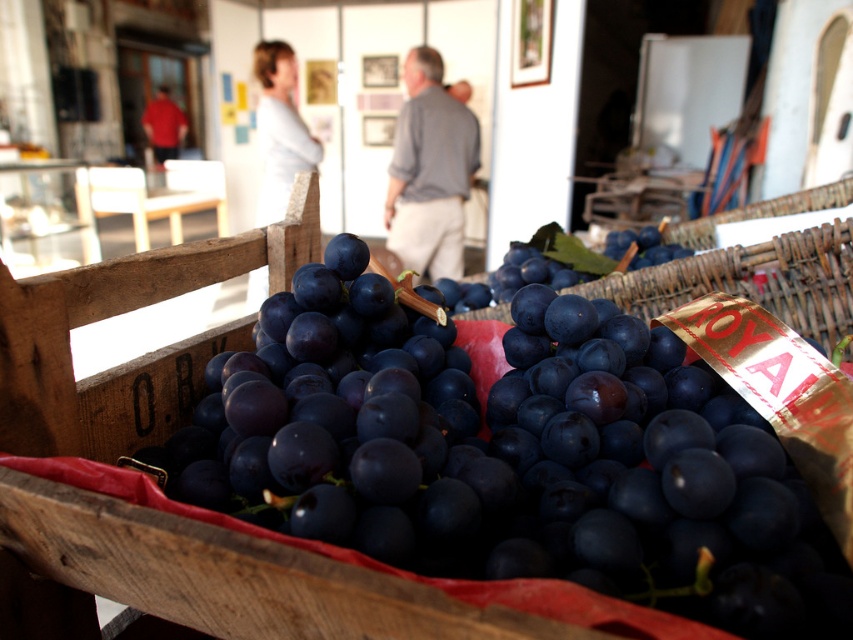
Does shiny dark purple grapes at center have a greater width compared to dark purple grapes at center?

No, shiny dark purple grapes at center is not wider than dark purple grapes at center.

In the scene shown: Is shiny dark purple grapes at center closer to the viewer compared to dark purple grapes at center?

That is True.

You are a GUI agent. You are given a task and a screenshot of the screen. Output one action in this format:
    pyautogui.click(x=<x>, y=<y>)
    Task: Click on the shiny dark purple grapes at center
    This screenshot has height=640, width=853.
    Given the screenshot: What is the action you would take?
    pyautogui.click(x=508, y=458)